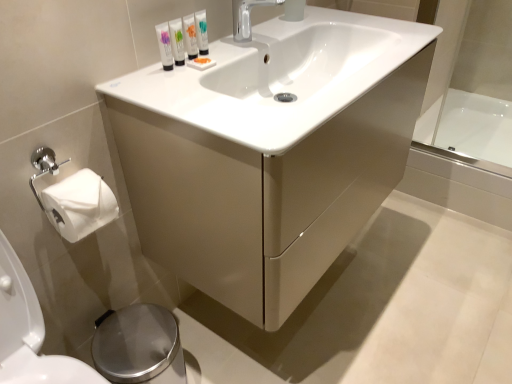
Image resolution: width=512 pixels, height=384 pixels. I want to click on vacant space to the right of white glossy tube at upper center, which is the 4th mouthwash in left-to-right order, so pyautogui.click(x=246, y=51).